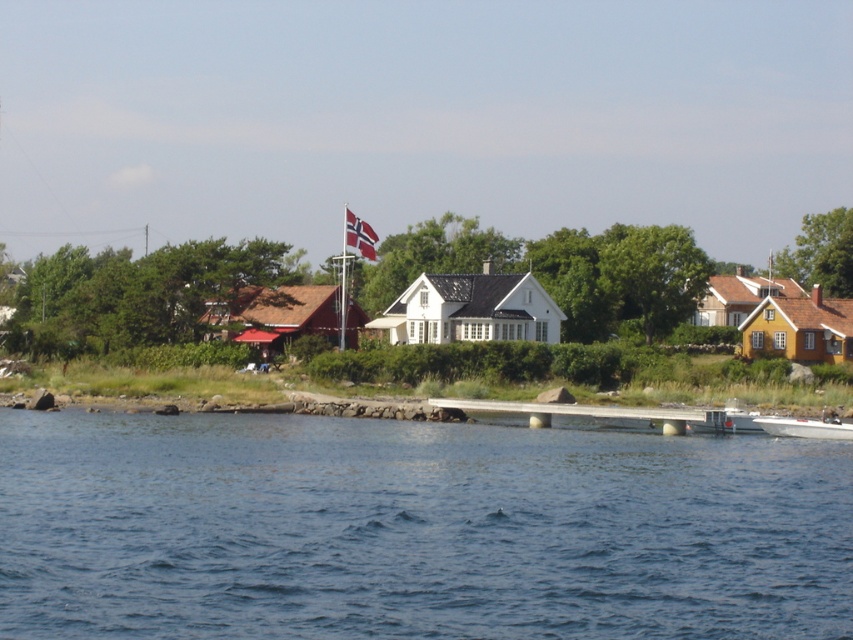
Is point (511, 572) positioned after point (671, 426)?

No, (511, 572) is closer to viewer.

Who is more forward, (180, 563) or (642, 413)?

Point (180, 563) is more forward.

Is point (624, 576) closer to camera compared to point (546, 420)?

Yes, it is in front of point (546, 420).

At what (x,y) coordinates should I click in order to perform the action: click on blue water at lower center. Please return your answer as a coordinate pair (x, y). The width and height of the screenshot is (853, 640). Looking at the image, I should click on (415, 529).

Is smooth concrete dock at center positioned before white plastic boat at lower right?

Yes, it is in front of white plastic boat at lower right.

Identify the location of smooth concrete dock at center. (593, 412).

You are a GUI agent. You are given a task and a screenshot of the screen. Output one action in this format:
    pyautogui.click(x=<x>, y=<y>)
    Task: Click on the smooth concrete dock at center
    Image resolution: width=853 pixels, height=640 pixels.
    Given the screenshot: What is the action you would take?
    pyautogui.click(x=593, y=412)

Can you confirm if blue water at lower center is bigger than white plastic boat at lower right?

Indeed, blue water at lower center has a larger size compared to white plastic boat at lower right.

Can you confirm if blue water at lower center is thinner than white plastic boat at lower right?

In fact, blue water at lower center might be wider than white plastic boat at lower right.

Who is more distant from viewer, (502, 576) or (785, 419)?

The point (785, 419) is more distant.

Locate an element on the screen. blue water at lower center is located at coordinates (415, 529).